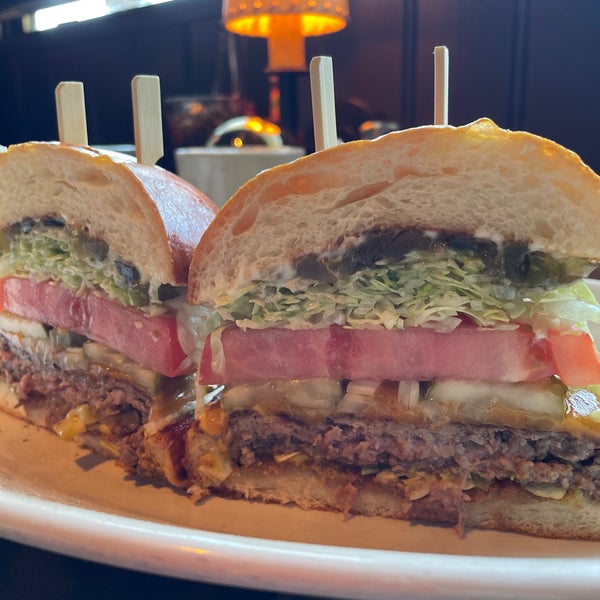
Locate an element on the screen. The width and height of the screenshot is (600, 600). nearest edge of plate is located at coordinates (200, 559).